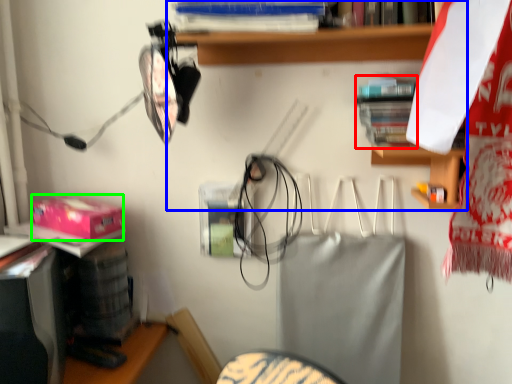
Question: Estimate the real-world distances between objects in this image. Which object is farther from book (highlighted by a red box), shelf (highlighted by a blue box) or box (highlighted by a green box)?

Choices:
 (A) shelf
 (B) box

Answer: (B)